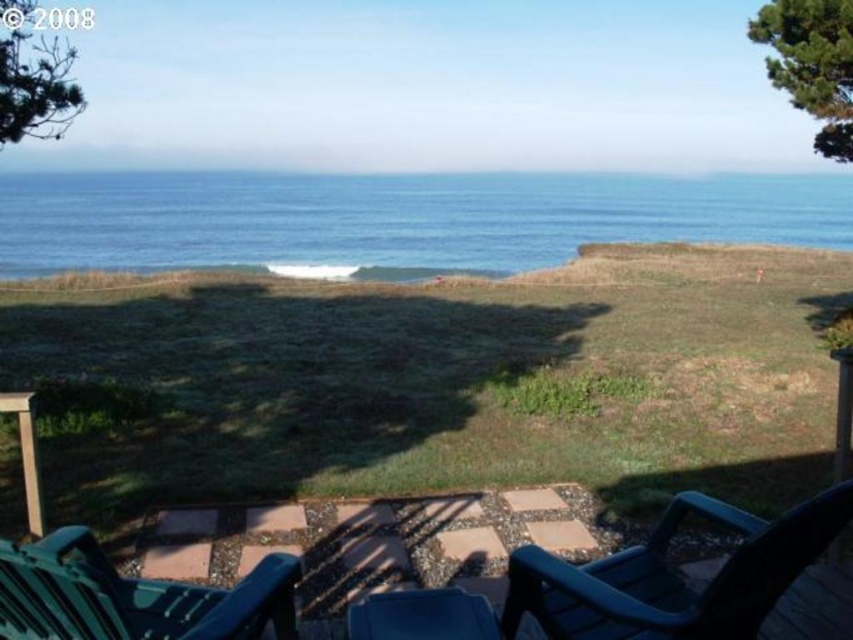
You are planning to place a large potted plant between the black plastic rocking chair at lower right and the blue plastic chair at lower center. Considering their widths, which chair should the plant be closer to to ensure it doesn

The black plastic rocking chair at lower right is wider than the blue plastic chair at lower center. To ensure the plant is centered between them, it should be placed closer to the blue plastic chair at lower center since the wider chair occupies more space.

You are sitting on the patio and want to move from the blue plastic chair at lower center to the black plastic rocking chair at lower right. Which chair will you have to stand up higher to reach?

The black plastic rocking chair at lower right is taller than the blue plastic chair at lower center, so you will have to stand up higher to reach it.